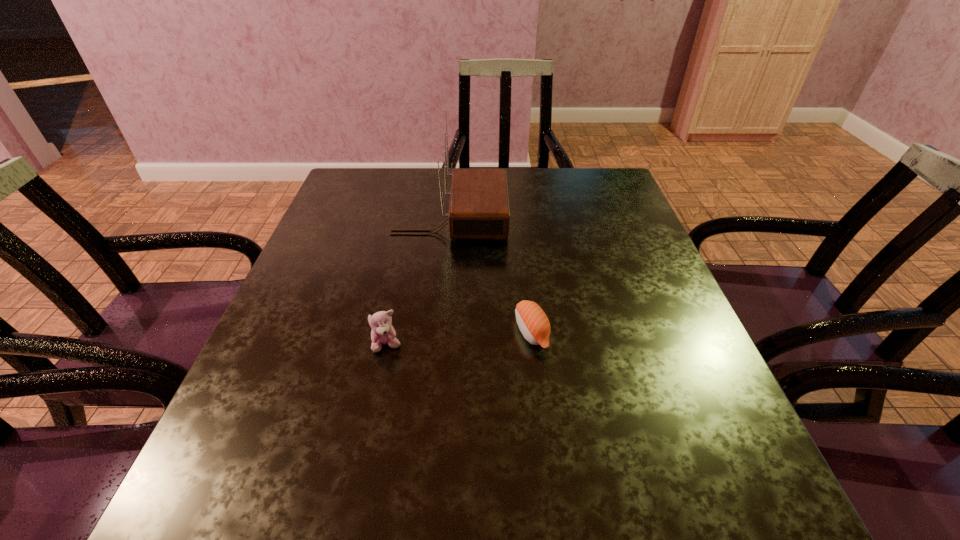
At what (x,y) coordinates should I click in order to perform the action: click on free space at the left edge of the desktop. Please return your answer as a coordinate pair (x, y). The height and width of the screenshot is (540, 960). Looking at the image, I should click on (329, 308).

In the image, there is a desktop. Where is `free space at the right edge`? free space at the right edge is located at coordinates click(626, 320).

This screenshot has width=960, height=540. I want to click on vacant region at the far left corner, so click(x=369, y=178).

You are a GUI agent. You are given a task and a screenshot of the screen. Output one action in this format:
    pyautogui.click(x=<x>, y=<y>)
    Task: Click on the vacant space at the far right corner of the desktop
    
    Given the screenshot: What is the action you would take?
    point(595,174)

In the image, there is a desktop. Identify the location of vacant space at the near right corner. This screenshot has height=540, width=960. (746, 486).

Where is `vacant space that is in between the second tallest object and the tallest object`? This screenshot has width=960, height=540. vacant space that is in between the second tallest object and the tallest object is located at coordinates (419, 282).

Identify the location of free area in between the second tallest object and the shortest object. The image size is (960, 540). (459, 339).

Where is `empty space that is in between the teddy bear and the tallest object`? empty space that is in between the teddy bear and the tallest object is located at coordinates (419, 282).

This screenshot has height=540, width=960. What are the coordinates of `free space that is in between the teddy bear and the shortest object` in the screenshot? It's located at (459, 339).

The width and height of the screenshot is (960, 540). In order to click on free space between the sushi and the tallest object in this screenshot , I will do `click(491, 275)`.